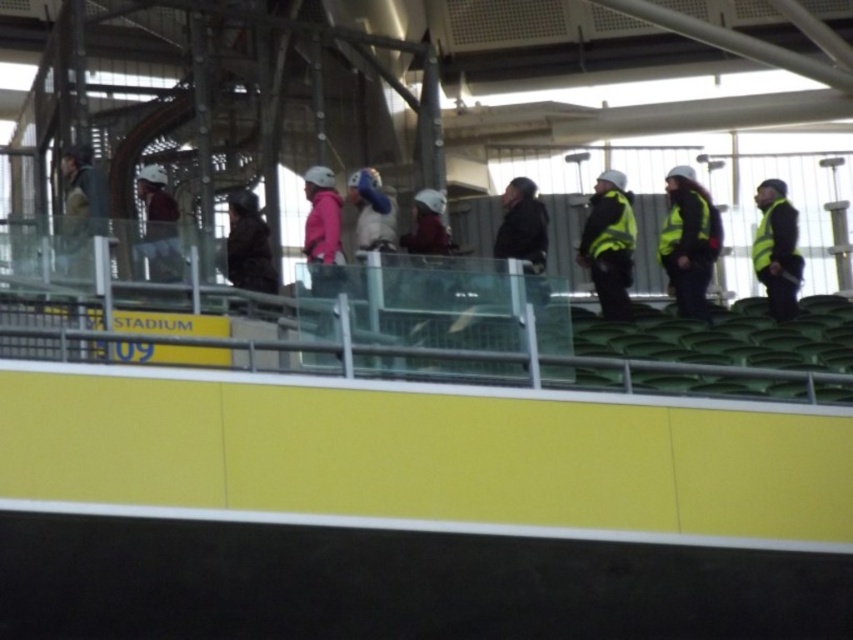
Who is positioned more to the left, high-visibility yellow vest at center or dark brown leather jacket at center?

dark brown leather jacket at center

Does high-visibility yellow vest at center have a lesser height compared to dark brown leather jacket at center?

Incorrect, high-visibility yellow vest at center's height does not fall short of dark brown leather jacket at center's.

Who is more forward, (616, 228) or (270, 273)?

Point (270, 273) is more forward.

Locate an element on the screen. high-visibility yellow vest at center is located at coordinates (608, 243).

Can you confirm if yellow reflective vest at right is positioned below dark brown leather jacket at center?

Yes, yellow reflective vest at right is below dark brown leather jacket at center.

Does yellow reflective vest at right have a smaller size compared to dark brown leather jacket at center?

Correct, yellow reflective vest at right occupies less space than dark brown leather jacket at center.

Between point (782, 308) and point (265, 278), which one is positioned behind?

Positioned behind is point (782, 308).

Identify the location of yellow reflective vest at right. The height and width of the screenshot is (640, 853). (776, 248).

Does high-visibility yellow vest at center appear over yellow reflective vest at right?

Yes, high-visibility yellow vest at center is above yellow reflective vest at right.

Can you confirm if high-visibility yellow vest at center is taller than yellow reflective vest at right?

Indeed, high-visibility yellow vest at center has a greater height compared to yellow reflective vest at right.

Find the location of a particular element. high-visibility yellow vest at center is located at coordinates (608, 243).